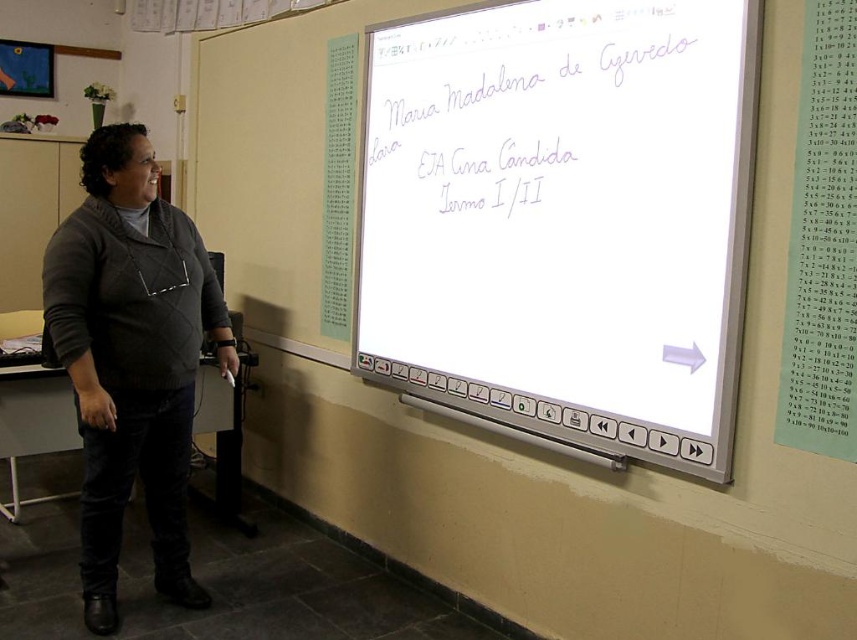
You are a student entering the classroom and need to locate the white glossy screen at upper center and the dark gray sweater at left. Which object is wider?

The white glossy screen at upper center is wider than the dark gray sweater at left.

You are a student sitting at the desk in the front row, directly facing the whiteboard. You notice two points marked on the whiteboard. The first point is at coordinates point (546, 371) and the second is at point (135, 278). From your perspective, which point appears closer to you?

Point (135, 278) appears closer because it is in front of point (546, 371) according to the spatial arrangement described.

You are a student sitting in the front row of the classroom. You need to hand a paper to the teacher who is wearing the dark gray sweater at left. The paper is on the white glossy screen at upper center. Can you reach it without leaving your seat?

The white glossy screen at upper center is closer to the viewer than dark gray sweater at left, so you can reach the paper on the white glossy screen at upper center from your seat since it is nearer to you than the teacher wearing dark gray sweater at left.